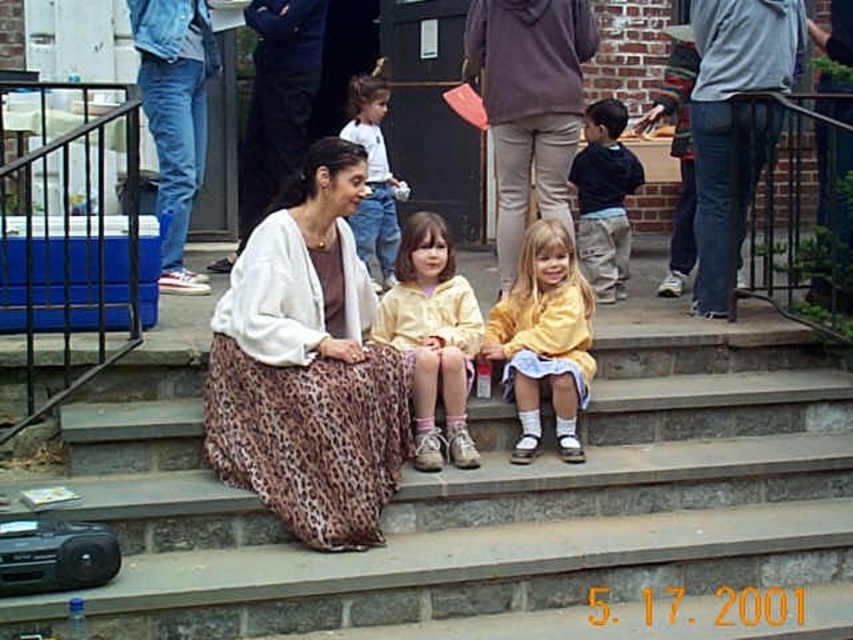
This screenshot has height=640, width=853. What do you see at coordinates (433, 339) in the screenshot?
I see `yellow fleece jacket at center` at bounding box center [433, 339].

Does yellow fleece jacket at center lie in front of denim jeans at left?

Yes, yellow fleece jacket at center is in front of denim jeans at left.

Between point (415, 362) and point (189, 74), which one is positioned behind?

Point (189, 74)

Identify the location of yellow fleece jacket at center. (433, 339).

Is point (525, 620) positioned behind point (546, 330)?

No, it is not.

The width and height of the screenshot is (853, 640). What do you see at coordinates (511, 509) in the screenshot?
I see `brown leopard print skirt at center` at bounding box center [511, 509].

Locate an element on the screen. The width and height of the screenshot is (853, 640). brown leopard print skirt at center is located at coordinates pos(511,509).

Locate an element on the screen. The image size is (853, 640). brown leopard print skirt at center is located at coordinates (511, 509).

Can you confirm if leopard print skirt at center is taller than gray cotton hoodie at upper right?

No, leopard print skirt at center is not taller than gray cotton hoodie at upper right.

Locate an element on the screen. The width and height of the screenshot is (853, 640). leopard print skirt at center is located at coordinates (306, 365).

The height and width of the screenshot is (640, 853). What do you see at coordinates (306, 365) in the screenshot?
I see `leopard print skirt at center` at bounding box center [306, 365].

Locate an element on the screen. The image size is (853, 640). leopard print skirt at center is located at coordinates (306, 365).